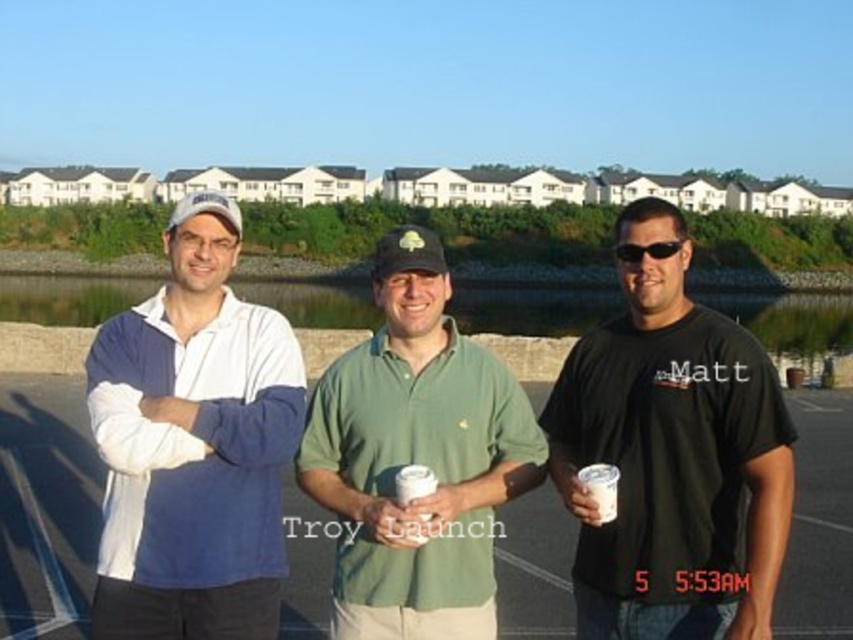
Does green cotton polo shirt at center appear on the left side of sunglasses at center?

Correct, you'll find green cotton polo shirt at center to the left of sunglasses at center.

Does green cotton polo shirt at center appear over sunglasses at center?

Actually, green cotton polo shirt at center is below sunglasses at center.

Between point (399, 380) and point (653, 248), which one is positioned behind?

Positioned behind is point (653, 248).

Image resolution: width=853 pixels, height=640 pixels. In order to click on green cotton polo shirt at center in this screenshot , I will do `click(416, 458)`.

Which is in front, point (473, 376) or point (611, 476)?

Point (611, 476) is more forward.

The height and width of the screenshot is (640, 853). I want to click on green cotton polo shirt at center, so click(x=416, y=458).

Who is lower down, black matte t-shirt at center or green cotton polo shirt at center?

green cotton polo shirt at center is below.

Based on the photo, can you confirm if black matte t-shirt at center is smaller than green cotton polo shirt at center?

No, black matte t-shirt at center is not smaller than green cotton polo shirt at center.

The height and width of the screenshot is (640, 853). Describe the element at coordinates (672, 458) in the screenshot. I see `black matte t-shirt at center` at that location.

This screenshot has width=853, height=640. I want to click on black matte t-shirt at center, so click(672, 458).